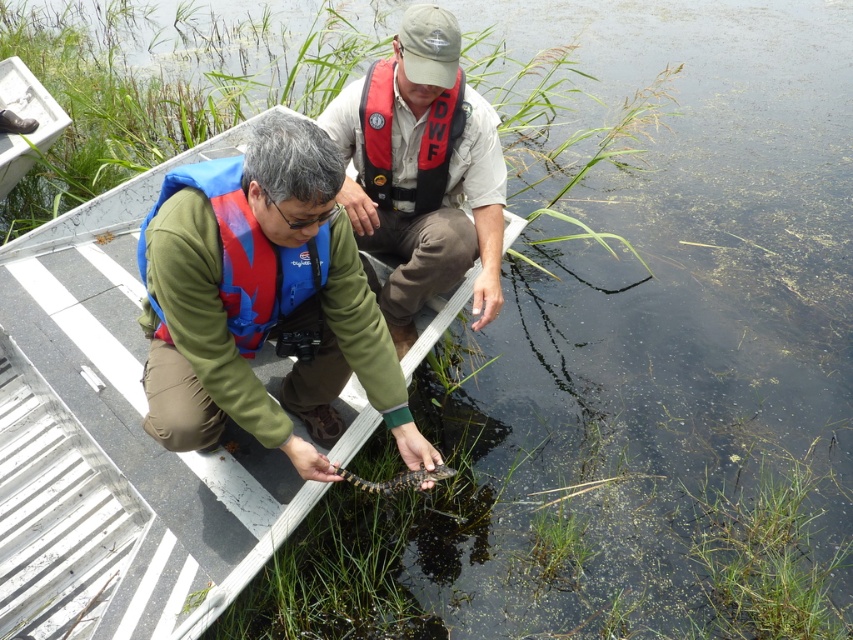
Which is more to the left, blue fabric life vest at lower left or blue fabric life jacket at lower left?

blue fabric life jacket at lower left

Which of these two, blue fabric life vest at lower left or blue fabric life jacket at lower left, stands taller?

Standing taller between the two is blue fabric life vest at lower left.

Is point (241, 365) positioned before point (245, 330)?

Yes, it is.

Where is `blue fabric life vest at lower left`? This screenshot has width=853, height=640. blue fabric life vest at lower left is located at coordinates (263, 301).

Between matte khaki shirt at center and blue fabric life jacket at lower left, which one is positioned higher?

Positioned higher is matte khaki shirt at center.

Can you confirm if matte khaki shirt at center is positioned below blue fabric life jacket at lower left?

No.

Does point (364, 84) come in front of point (155, 328)?

No, it is not.

Identify the location of matte khaki shirt at center. (422, 170).

Which is more to the right, blue fabric life vest at lower left or red nylon life jacket at center?

red nylon life jacket at center is more to the right.

What do you see at coordinates (263, 301) in the screenshot? I see `blue fabric life vest at lower left` at bounding box center [263, 301].

What do you see at coordinates (263, 301) in the screenshot?
I see `blue fabric life vest at lower left` at bounding box center [263, 301].

You are a GUI agent. You are given a task and a screenshot of the screen. Output one action in this format:
    pyautogui.click(x=<x>, y=<y>)
    Task: Click on the blue fabric life vest at lower left
    
    Given the screenshot: What is the action you would take?
    pyautogui.click(x=263, y=301)